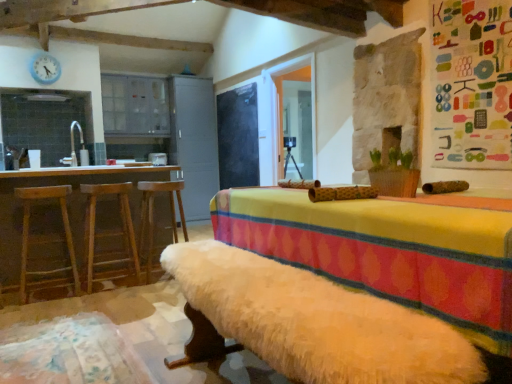
This screenshot has width=512, height=384. What do you see at coordinates (45, 235) in the screenshot? I see `wooden bar stool at left, the 1th bar stool from the left` at bounding box center [45, 235].

This screenshot has width=512, height=384. What do you see at coordinates (45, 68) in the screenshot?
I see `white plastic clock at upper left` at bounding box center [45, 68].

What is the approximate width of wooden bar stool at left, the third bar stool positioned from the left?

39.27 centimeters.

Measure the distance between point (139,237) and camera.

Point (139,237) is 11.18 feet away from camera.

What do you see at coordinates (472, 83) in the screenshot? Image resolution: width=512 pixels, height=384 pixels. I see `colorful fabric bulletin board at upper right, acting as the second bulletin board starting from the back` at bounding box center [472, 83].

You are a GUI agent. You are given a task and a screenshot of the screen. Output one action in this format:
    pyautogui.click(x=<x>, y=<y>)
    Task: Click on the colorful fabric bulletin board at upper right, arranged as the 1th bulletin board when viewed from the right
    
    Given the screenshot: What is the action you would take?
    pyautogui.click(x=472, y=83)

Locate an element on the screen. The width and height of the screenshot is (512, 384). fluffy white rug at lower left is located at coordinates (69, 353).

Locate an element on the screen. wooden bar stool at left, the 1th bar stool from the left is located at coordinates (45, 235).

Is brown wooden table at left touching wooden bar stool at left, the 1th bar stool from the left?

brown wooden table at left and wooden bar stool at left, the 1th bar stool from the left, are clearly separated.

In the scene shown: From a real-world perspective, is brown wooden table at left under wooden bar stool at left, the 1th bar stool from the left?

Actually, brown wooden table at left is physically above wooden bar stool at left, the 1th bar stool from the left, in the real world.

Is brown wooden table at left facing away from wooden bar stool at left, the 1th bar stool from the left?

brown wooden table at left is not turned away from wooden bar stool at left, the 1th bar stool from the left.

Does wooden bar stool at left, the third bar stool positioned from the left, have a lesser width compared to brown wooden table at left?

Yes.

Which of these two, wooden bar stool at left, arranged as the 1th bar stool when viewed from the right, or brown wooden table at left, stands shorter?

With less height is wooden bar stool at left, arranged as the 1th bar stool when viewed from the right.

From a real-world perspective, is wooden bar stool at left, arranged as the 1th bar stool when viewed from the right, above or below brown wooden table at left?

wooden bar stool at left, arranged as the 1th bar stool when viewed from the right, is situated lower than brown wooden table at left in the real world.

Based on the photo, is wooden bar stool at left, the third bar stool positioned from the left, oriented away from brown wooden table at left?

No, wooden bar stool at left, the third bar stool positioned from the left, is not facing the opposite direction of brown wooden table at left.

Which is in front, transparent glass door at center or wooden bar stool at left, arranged as the second bar stool when viewed from the right?

wooden bar stool at left, arranged as the second bar stool when viewed from the right, is in front.

From the picture: Measure the distance between transparent glass door at center and wooden bar stool at left, which is the 2th bar stool in left-to-right order.

transparent glass door at center is 2.45 meters from wooden bar stool at left, which is the 2th bar stool in left-to-right order.

Which of these two, transparent glass door at center or wooden bar stool at left, which is the 2th bar stool in left-to-right order, is wider?

With larger width is wooden bar stool at left, which is the 2th bar stool in left-to-right order.

Is point (88, 191) less distant than point (92, 312)?

No, (88, 191) is further to viewer.

Which is in front, wooden bar stool at left, arranged as the second bar stool when viewed from the right, or fluffy white rug at lower left?

fluffy white rug at lower left is in front.

From the image's perspective, is wooden bar stool at left, arranged as the second bar stool when viewed from the right, above or below fluffy white rug at lower left?

wooden bar stool at left, arranged as the second bar stool when viewed from the right, is situated higher than fluffy white rug at lower left in the image.

Is wooden bar stool at left, arranged as the second bar stool when viewed from the right, far away from fluffy white rug at lower left?

Absolutely, wooden bar stool at left, arranged as the second bar stool when viewed from the right, is distant from fluffy white rug at lower left.

Can transparent glass door at center be found inside blackboard at center, positioned as the second bulletin board in front-to-back order?

That's incorrect, transparent glass door at center is not inside blackboard at center, positioned as the second bulletin board in front-to-back order.

Considering the sizes of objects blackboard at center, the 1th bulletin board positioned from the back, and transparent glass door at center in the image provided, who is taller, blackboard at center, the 1th bulletin board positioned from the back, or transparent glass door at center?

blackboard at center, the 1th bulletin board positioned from the back, is taller.

From a real-world perspective, which is physically below, blackboard at center, the 1th bulletin board positioned from the back, or transparent glass door at center?

blackboard at center, the 1th bulletin board positioned from the back.

Can you see blackboard at center, positioned as the first bulletin board in left-to-right order, touching transparent glass door at center?

They are not placed beside each other.

Is brown wooden table at left with blackboard at center, the 1th bulletin board positioned from the back?

No, brown wooden table at left is not next to blackboard at center, the 1th bulletin board positioned from the back.

From a real-world perspective, who is located lower, brown wooden table at left or blackboard at center, the 1th bulletin board positioned from the back?

brown wooden table at left.

Is brown wooden table at left completely or partially outside of blackboard at center, positioned as the first bulletin board in left-to-right order?

Yes, brown wooden table at left is located beyond the bounds of blackboard at center, positioned as the first bulletin board in left-to-right order.

Is transparent glass door at center far away from fluffy white rug at lower left?

Indeed, transparent glass door at center is not near fluffy white rug at lower left.

Considering the positions of point (277, 147) and point (97, 380), is point (277, 147) closer or farther from the camera than point (97, 380)?

Point (277, 147) is farther from the camera than point (97, 380).

Which is more to the right, transparent glass door at center or fluffy white rug at lower left?

transparent glass door at center.

At what (x,y) coordinates should I click in order to perform the action: click on table located above the wooden bar stool at left, marked as the 3th bar stool in a right-to-left arrangement (from the image's perspective). Please return your answer as a coordinate pair (x, y). The height and width of the screenshot is (384, 512). Looking at the image, I should click on (67, 204).

There is a brown wooden table at left. At what (x,y) coordinates should I click in order to perform the action: click on the 3rd bar stool below it (from a real-world perspective). Please return your answer as a coordinate pair (x, y). Looking at the image, I should click on [x=153, y=215].

From the image, which object appears to be farther from white plastic clock at upper left, wooden bar stool at left, which is the 2th bar stool in left-to-right order, or brown wooden table at left?

wooden bar stool at left, which is the 2th bar stool in left-to-right order.

From the image, which object appears to be farther from wooden bar stool at left, which is the 2th bar stool in left-to-right order, white plastic clock at upper left or colorful fabric bulletin board at upper right, which is the 1th bulletin board from front to back?

Based on the image, white plastic clock at upper left appears to be further to wooden bar stool at left, which is the 2th bar stool in left-to-right order.

Looking at the image, which one is located further to blackboard at center, which ranks as the second bulletin board in right-to-left order, colorful fabric bulletin board at upper right, arranged as the 1th bulletin board when viewed from the right, or transparent glass door at center?

The object further to blackboard at center, which ranks as the second bulletin board in right-to-left order, is colorful fabric bulletin board at upper right, arranged as the 1th bulletin board when viewed from the right.

From the image, which object appears to be farther from wooden bar stool at left, arranged as the second bar stool when viewed from the right, wooden bar stool at left, marked as the 3th bar stool in a right-to-left arrangement, or fluffy white rug at lower left?

The object further to wooden bar stool at left, arranged as the second bar stool when viewed from the right, is fluffy white rug at lower left.

From the picture: Based on their spatial positions, is transparent glass door at center or colorful fabric bulletin board at upper right, which is the 2th bulletin board from left to right, closer to wooden bar stool at left, arranged as the second bar stool when viewed from the right?

Based on the image, transparent glass door at center appears to be nearer to wooden bar stool at left, arranged as the second bar stool when viewed from the right.

Estimate the real-world distances between objects in this image. Which object is closer to wooden bar stool at left, arranged as the second bar stool when viewed from the right, transparent glass door at center or wooden bar stool at left, arranged as the 1th bar stool when viewed from the right?

wooden bar stool at left, arranged as the 1th bar stool when viewed from the right, lies closer to wooden bar stool at left, arranged as the second bar stool when viewed from the right, than the other object.

Based on their spatial positions, is transparent glass door at center or wooden bar stool at left, arranged as the 1th bar stool when viewed from the right, further from wooden bar stool at left, the 1th bar stool from the left?

transparent glass door at center.

Which object lies nearer to the anchor point brown wooden table at left, blackboard at center, the 1th bulletin board positioned from the back, or wooden bar stool at left, the 1th bar stool from the left?

The object closer to brown wooden table at left is wooden bar stool at left, the 1th bar stool from the left.

Identify the location of bar stool between brown wooden table at left and wooden bar stool at left, arranged as the 1th bar stool when viewed from the right, from left to right. Image resolution: width=512 pixels, height=384 pixels. (108, 230).

Where is `table between wooden bar stool at left, the 1th bar stool from the left, and wooden bar stool at left, arranged as the second bar stool when viewed from the right, in the horizontal direction`? The height and width of the screenshot is (384, 512). table between wooden bar stool at left, the 1th bar stool from the left, and wooden bar stool at left, arranged as the second bar stool when viewed from the right, in the horizontal direction is located at coordinates (67, 204).

You are a GUI agent. You are given a task and a screenshot of the screen. Output one action in this format:
    pyautogui.click(x=<x>, y=<y>)
    Task: Click on the bar stool located between wooden bar stool at left, arranged as the second bar stool when viewed from the right, and colorful fabric bulletin board at upper right, arranged as the 1th bulletin board when viewed from the right, in the left-right direction
    The image size is (512, 384).
    Given the screenshot: What is the action you would take?
    pyautogui.click(x=153, y=215)

Where is `bulletin board between fluffy white rug at lower left and blackboard at center, positioned as the first bulletin board in left-to-right order, from front to back`? Image resolution: width=512 pixels, height=384 pixels. bulletin board between fluffy white rug at lower left and blackboard at center, positioned as the first bulletin board in left-to-right order, from front to back is located at coordinates (472, 83).